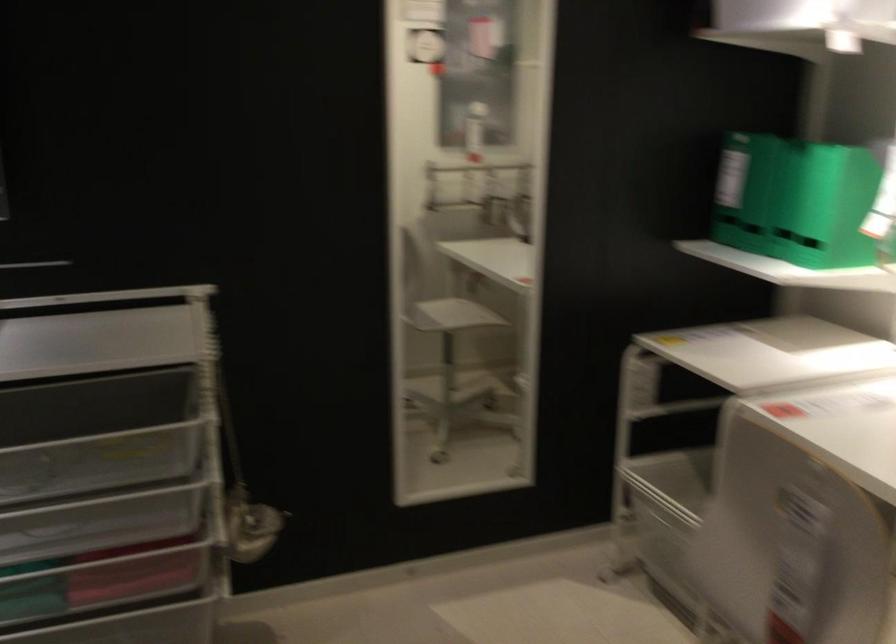
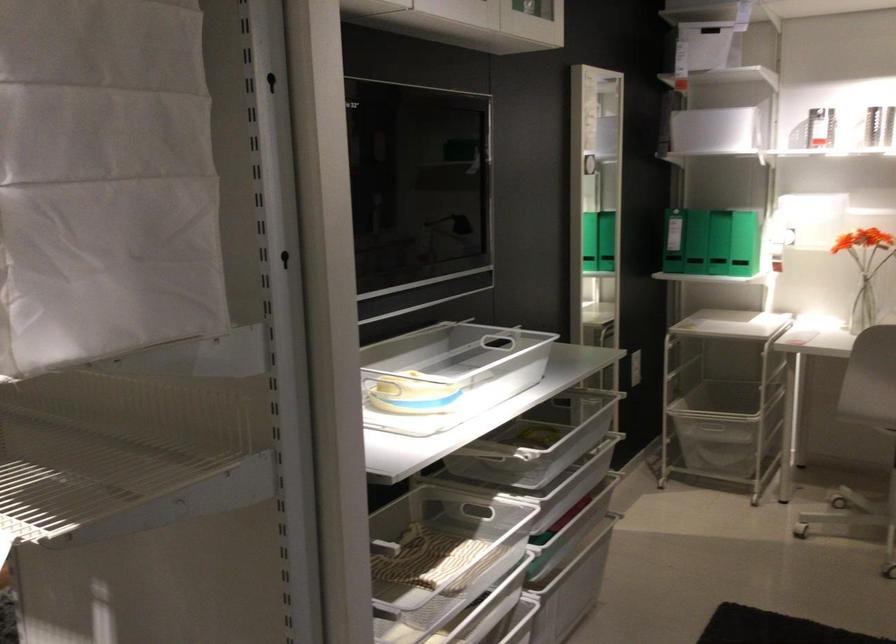
The point at (769,227) is marked in the first image. Where is the corresponding point in the second image?

(745, 243)